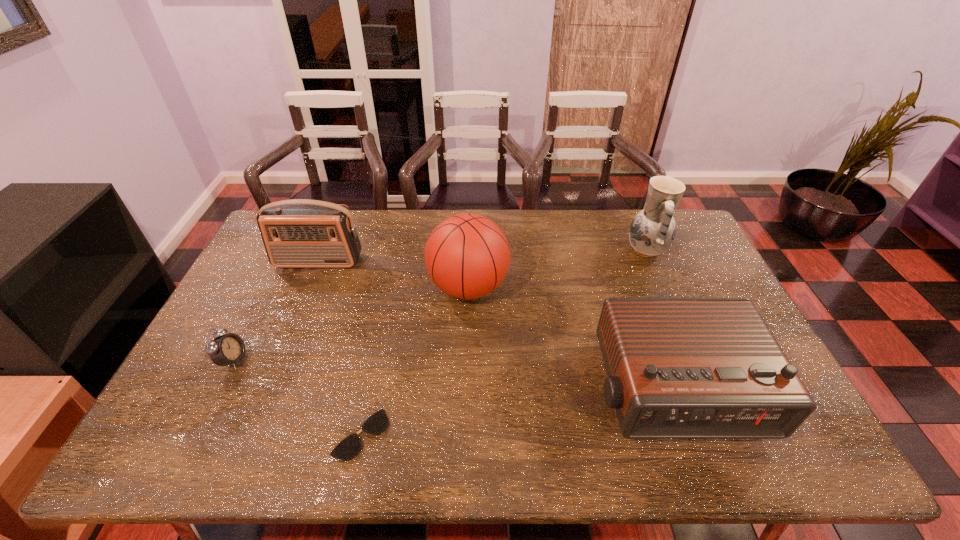
The height and width of the screenshot is (540, 960). Find the location of `vacant space that satisfies the following two spatial constraints: 1. on the front-facing side of the farther radio receiver; 2. on the right side of the fourth object from left to right`. vacant space that satisfies the following two spatial constraints: 1. on the front-facing side of the farther radio receiver; 2. on the right side of the fourth object from left to right is located at coordinates (308, 287).

The image size is (960, 540). Identify the location of vacant space that satisfies the following two spatial constraints: 1. on the front-facing side of the farther radio receiver; 2. on the left side of the third object from right to left. (308, 287).

Where is `free point that satisfies the following two spatial constraints: 1. on the front-facing side of the left radio receiver; 2. on the face of the alarm clock`? The height and width of the screenshot is (540, 960). free point that satisfies the following two spatial constraints: 1. on the front-facing side of the left radio receiver; 2. on the face of the alarm clock is located at coordinates (278, 360).